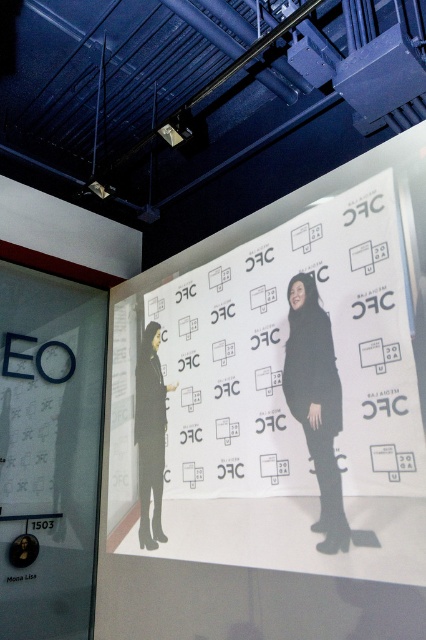
Question: Does white paper at center appear on the right side of black matte coat at left?

Choices:
 (A) no
 (B) yes

Answer: (B)

Question: Considering the real-world distances, which object is closest to the black matte coat at center?

Choices:
 (A) white paper at center
 (B) black matte coat at left

Answer: (A)

Question: Where is white paper at center located in relation to black matte coat at left in the image?

Choices:
 (A) left
 (B) right

Answer: (B)

Question: Which of the following is the farthest from the observer?

Choices:
 (A) black matte coat at left
 (B) black matte coat at center
 (C) white paper at center

Answer: (A)

Question: Which of the following is the closest to the observer?

Choices:
 (A) black matte coat at center
 (B) black matte coat at left

Answer: (A)

Question: Is black matte coat at center below black matte coat at left?

Choices:
 (A) yes
 (B) no

Answer: (B)